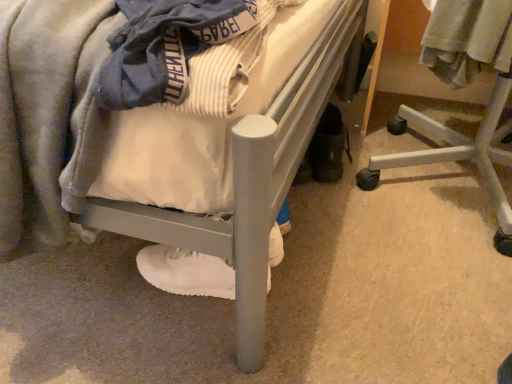
Question: Could you tell me if white matte sneaker at lower center is facing white plastic chair at lower right?

Choices:
 (A) no
 (B) yes

Answer: (A)

Question: From the image's perspective, is white matte sneaker at lower center above white plastic chair at lower right?

Choices:
 (A) yes
 (B) no

Answer: (B)

Question: Considering the relative sizes of white matte sneaker at lower center and white plastic chair at lower right in the image provided, is white matte sneaker at lower center thinner than white plastic chair at lower right?

Choices:
 (A) no
 (B) yes

Answer: (B)

Question: Is white plastic chair at lower right located within white matte sneaker at lower center?

Choices:
 (A) no
 (B) yes

Answer: (A)

Question: Is white matte sneaker at lower center taller than white plastic chair at lower right?

Choices:
 (A) no
 (B) yes

Answer: (A)

Question: Is white plastic chair at lower right wider or thinner than white matte sneaker at lower center?

Choices:
 (A) thin
 (B) wide

Answer: (B)

Question: Considering the relative positions of white plastic chair at lower right and white matte sneaker at lower center in the image provided, is white plastic chair at lower right to the left or to the right of white matte sneaker at lower center?

Choices:
 (A) right
 (B) left

Answer: (A)

Question: From the image's perspective, is white plastic chair at lower right positioned above or below white matte sneaker at lower center?

Choices:
 (A) above
 (B) below

Answer: (A)

Question: Is white plastic chair at lower right situated inside white matte sneaker at lower center or outside?

Choices:
 (A) inside
 (B) outside

Answer: (B)

Question: From the image's perspective, is matte gray bed at center located above or below white plastic chair at lower right?

Choices:
 (A) above
 (B) below

Answer: (A)

Question: Considering the positions of matte gray bed at center and white plastic chair at lower right in the image, is matte gray bed at center wider or thinner than white plastic chair at lower right?

Choices:
 (A) thin
 (B) wide

Answer: (B)

Question: Based on their sizes in the image, would you say matte gray bed at center is bigger or smaller than white plastic chair at lower right?

Choices:
 (A) small
 (B) big

Answer: (B)

Question: Would you say matte gray bed at center is to the left or to the right of white plastic chair at lower right in the picture?

Choices:
 (A) right
 (B) left

Answer: (B)

Question: From a real-world perspective, is white plastic chair at lower right positioned above or below light gray cotton shirt at upper right?

Choices:
 (A) above
 (B) below

Answer: (B)

Question: From their relative heights in the image, would you say white plastic chair at lower right is taller or shorter than light gray cotton shirt at upper right?

Choices:
 (A) tall
 (B) short

Answer: (A)